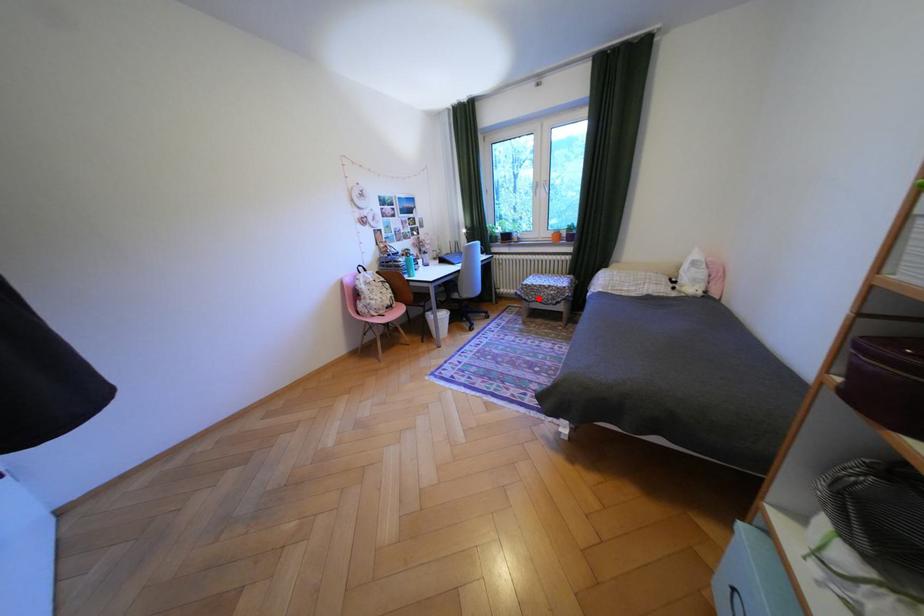
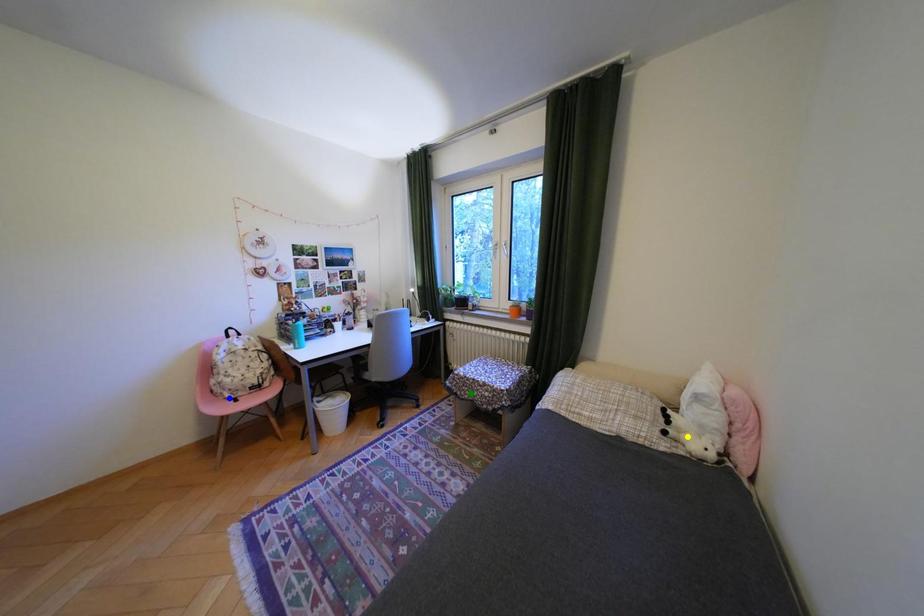
Question: I am providing you with two images of the same scene from different viewpoints. A red point is marked on the first image. You are given multiple points on the second image. Can you choose the point in image 2 that corresponds to the point in image 1?

Choices:
 (A) green point
 (B) yellow point
 (C) blue point

Answer: (A)